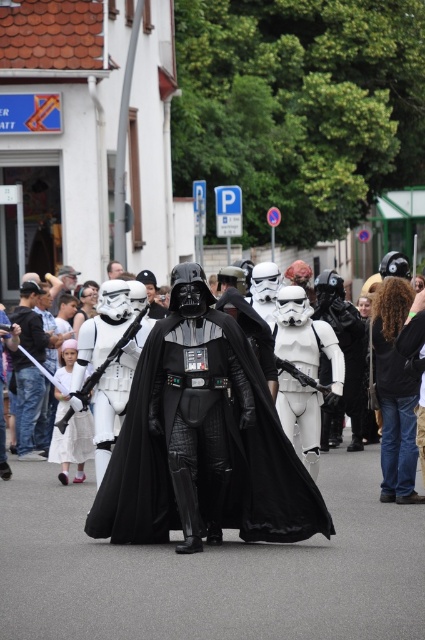
Question: Which object is farther from the camera taking this photo?

Choices:
 (A) black matte helmet at center
 (B) matte black helmet at center
 (C) shiny black cape at center

Answer: (A)

Question: Which point is closer to the camera taking this photo?

Choices:
 (A) (34, 376)
 (B) (116, 260)

Answer: (A)

Question: Based on their relative distances, which object is farther from the black matte helmet at center?

Choices:
 (A) shiny black cape at center
 (B) matte black helmet at center

Answer: (A)

Question: Can you confirm if shiny black cape at center is smaller than black matte helmet at center?

Choices:
 (A) yes
 (B) no

Answer: (B)

Question: Is matte black helmet at center positioned behind black matte helmet at center?

Choices:
 (A) yes
 (B) no

Answer: (B)

Question: Can you confirm if shiny black cape at center is smaller than matte black helmet at center?

Choices:
 (A) yes
 (B) no

Answer: (B)